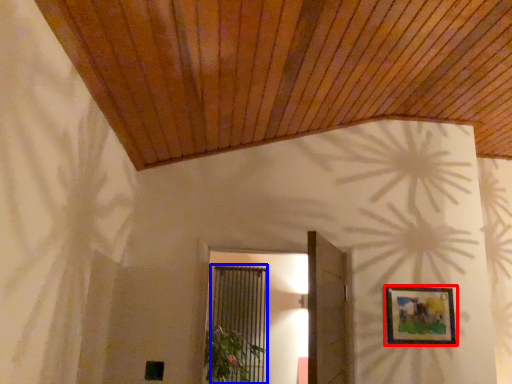
Question: Which point is closer to the camera, picture frame (highlighted by a red box) or screen door (highlighted by a blue box)?

Choices:
 (A) picture frame
 (B) screen door

Answer: (A)